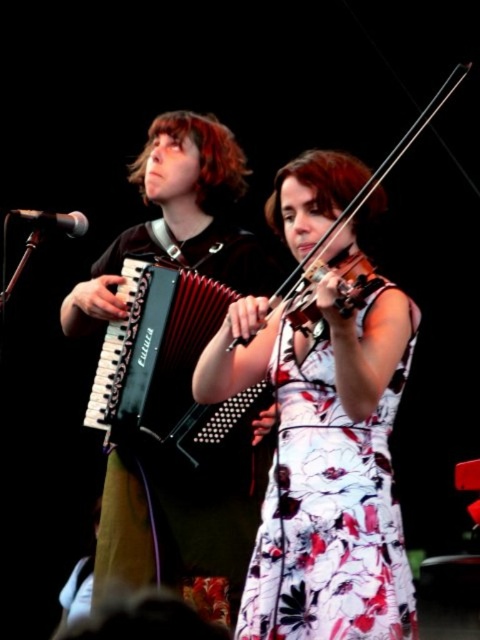
Question: Which point is closer to the camera taking this photo?

Choices:
 (A) (202, 529)
 (B) (14, 211)

Answer: (B)

Question: Is black matte accordion at left to the left of floral printed dress at center from the viewer's perspective?

Choices:
 (A) yes
 (B) no

Answer: (A)

Question: Can you confirm if black matte accordion at left is positioned to the left of wooden violin at center?

Choices:
 (A) yes
 (B) no

Answer: (A)

Question: Which of the following is the closest to the observer?

Choices:
 (A) floral printed dress at center
 (B) wooden violin at center
 (C) black plastic accordion at left
 (D) black matte accordion at left

Answer: (A)

Question: Is black matte accordion at left to the left of floral printed dress at center from the viewer's perspective?

Choices:
 (A) yes
 (B) no

Answer: (A)

Question: Among these points, which one is nearest to the camera?

Choices:
 (A) (188, 236)
 (B) (230, 442)

Answer: (B)